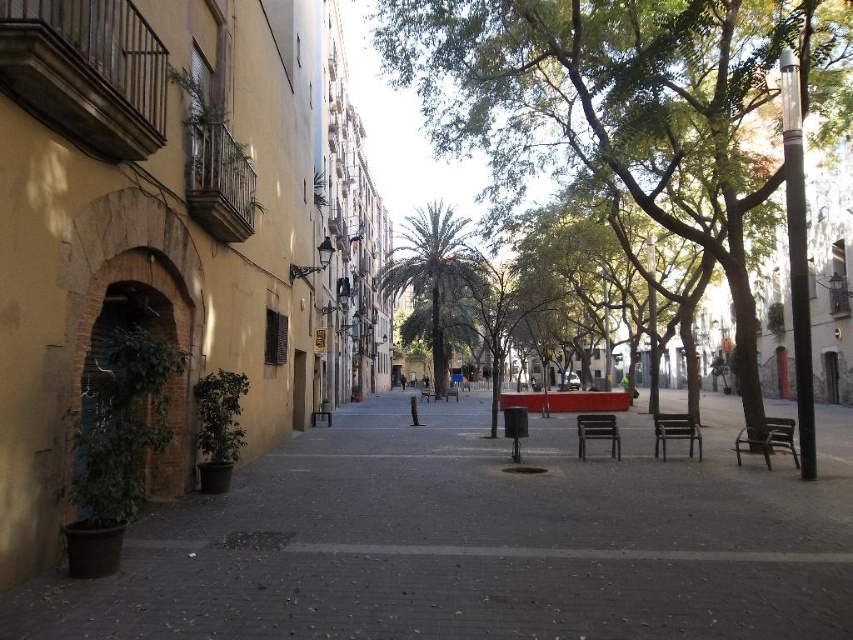
Can you confirm if wooden park bench at center is positioned to the right of black plastic bench at center?

No, wooden park bench at center is not to the right of black plastic bench at center.

Does point (659, 428) lie in front of point (613, 442)?

Yes, point (659, 428) is closer to viewer.

The height and width of the screenshot is (640, 853). What do you see at coordinates (675, 433) in the screenshot?
I see `wooden park bench at center` at bounding box center [675, 433].

The height and width of the screenshot is (640, 853). I want to click on wooden park bench at center, so click(675, 433).

Is green leafy tree at center further to the viewer compared to wooden park bench at center?

No, it is not.

Describe the element at coordinates (633, 116) in the screenshot. I see `green leafy tree at center` at that location.

Locate an element on the screen. This screenshot has height=640, width=853. green leafy tree at center is located at coordinates click(633, 116).

Which is more to the left, green leafy palm tree at center or wooden bench at center?

Positioned to the left is wooden bench at center.

In the scene shown: Measure the distance between point (448,268) and camera.

The distance of point (448,268) from camera is 36.62 meters.

Identify the location of green leafy palm tree at center. (432, 273).